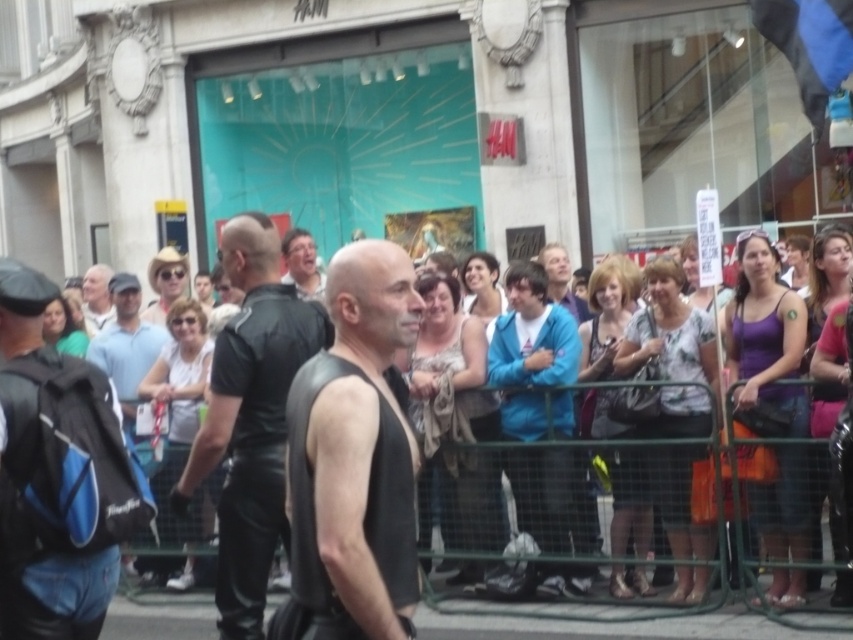
This screenshot has height=640, width=853. What do you see at coordinates (251, 417) in the screenshot?
I see `black leather jacket at center` at bounding box center [251, 417].

Between point (251, 390) and point (85, 312), which one is positioned behind?

Positioned behind is point (85, 312).

The height and width of the screenshot is (640, 853). I want to click on black leather jacket at center, so click(x=251, y=417).

What do you see at coordinates (606, 621) in the screenshot? This screenshot has width=853, height=640. I see `matte black leather jacket at center` at bounding box center [606, 621].

Can you confirm if matte black leather jacket at center is positioned to the right of matte black shirt at center?

Indeed, matte black leather jacket at center is positioned on the right side of matte black shirt at center.

Is point (204, 621) farther from camera compared to point (300, 252)?

No.

The width and height of the screenshot is (853, 640). What are the coordinates of `matte black leather jacket at center` in the screenshot? It's located at (606, 621).

Is black leather vest at center positioned before matte black leather jacket at center?

Yes.

Does point (338, 397) lie in front of point (682, 618)?

That is True.

Locate an element on the screen. black leather vest at center is located at coordinates (357, 452).

The width and height of the screenshot is (853, 640). In order to click on black leather vest at center in this screenshot , I will do `click(357, 452)`.